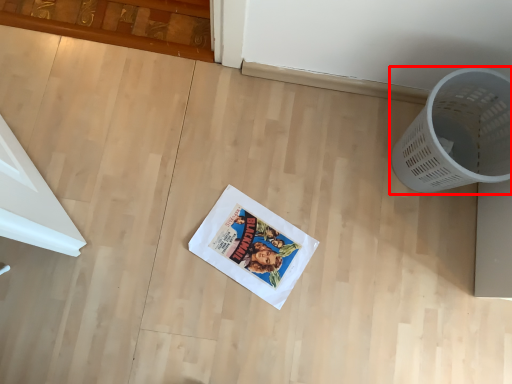
Question: From the image's perspective, where is waste container (annotated by the red box) located in relation to comic book in the image?

Choices:
 (A) above
 (B) below

Answer: (A)